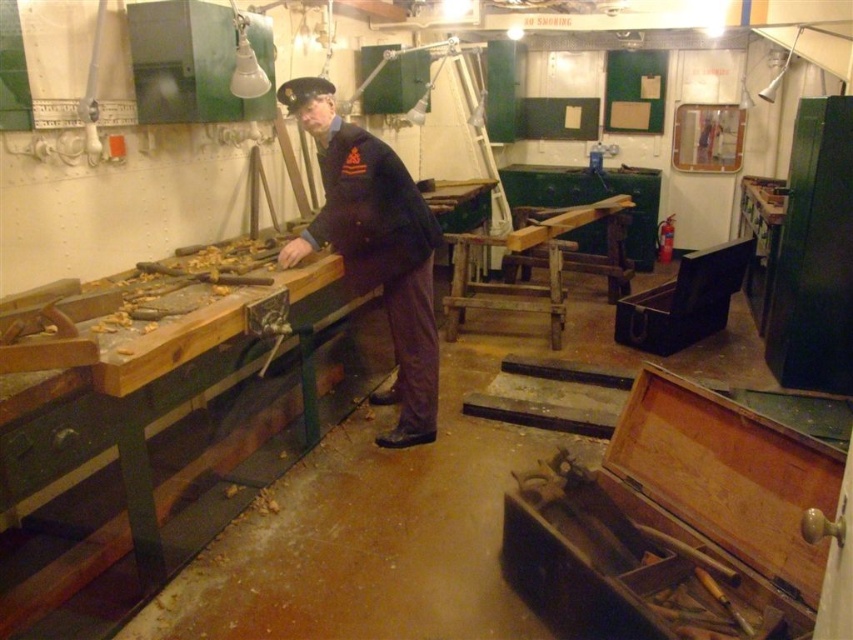
You are standing in the workshop and want to reach the point at coordinates point (x=370, y=262). If your arm can reach 2.5 meters, can you touch it without moving closer?

The point (x=370, y=262) is 3.20 meters away from the camera, so no, you cannot touch it with your arm which can only reach 2.5 meters.

You are a tailor in the workshop and need to determine which item takes up more space between the dark blue uniform at center and the black fabric cap at upper center. Which one is larger?

The dark blue uniform at center is bigger than the black fabric cap at upper center, so the dark blue uniform at center takes up more space.